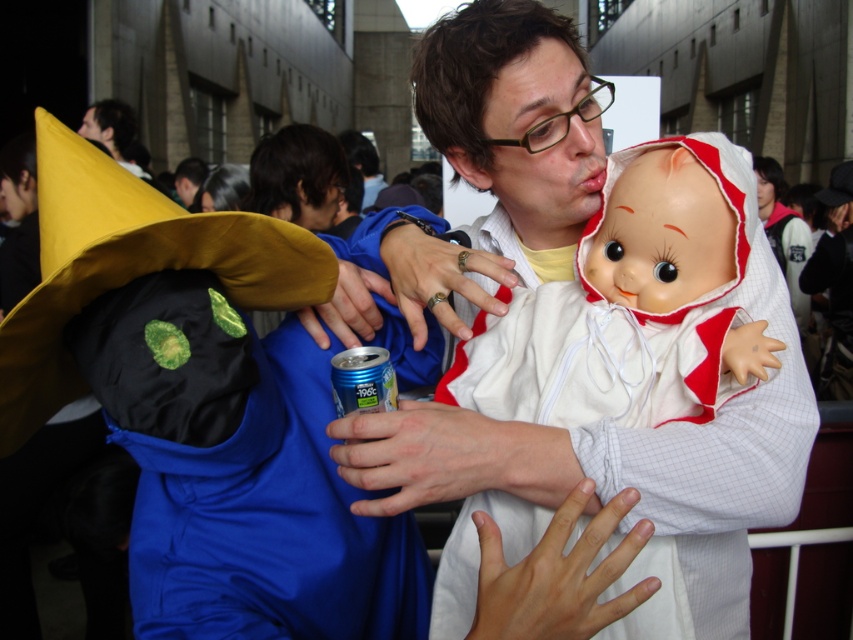
In the scene shown: You are a photographer at the event and want to capture both the black matte fabric at left and the dark brown hair at upper left in a single frame. Which object should you focus on first to ensure both are in the frame?

The black matte fabric at left is smaller than the dark brown hair at upper left, so you should focus on the dark brown hair at upper left first to ensure both are in the frame.

What is located at the coordinates point (x=204, y=406) in the image?

The coordinates point (x=204, y=406) correspond to black matte fabric at left.